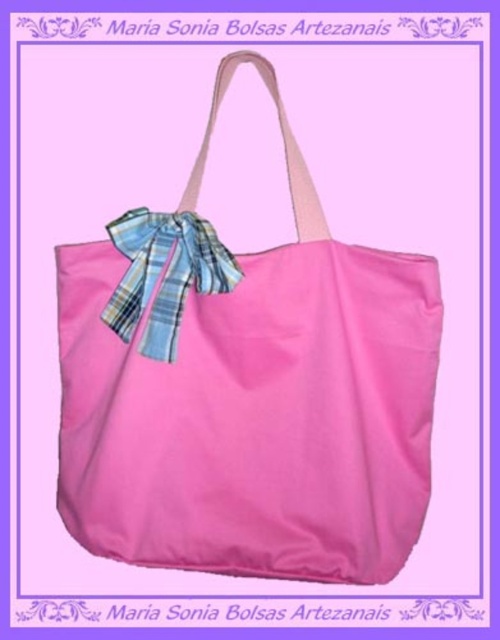
You are trying to organize your bag and bow on a shelf. The shelf has a small divider in the middle. If you place the matte pink fabric shoulder bag at center and the plaid fabric bow at center on the shelf, which one should go on the left side of the divider?

The plaid fabric bow at center should be placed on the left side of the divider because the matte pink fabric shoulder bag at center is to the right of it.

You are trying to decide if the matte pink fabric shoulder bag at center will fit into a storage box that is exactly the same width as the plaid fabric bow at center. Based on the description, can the bag fit into the box?

The matte pink fabric shoulder bag at center might be wider than the plaid fabric bow at center, so it may not fit into the storage box with the same width as the bow.